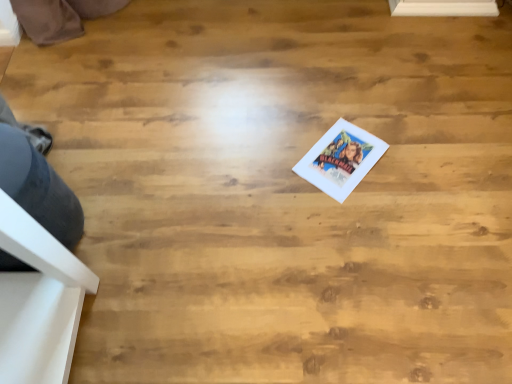
Find the location of a particular element. free space to the left of matte paper postcard at center is located at coordinates (274, 164).